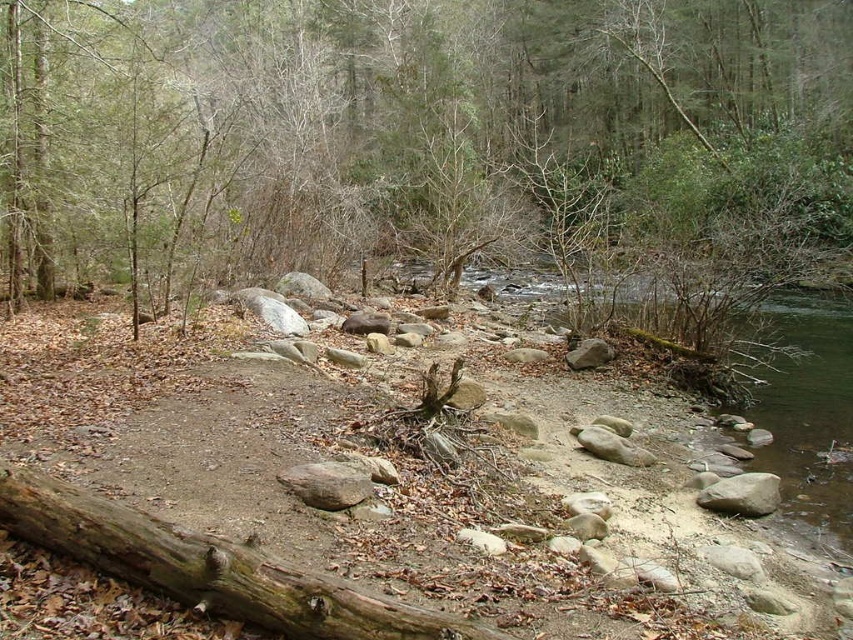
You are standing at the point with coordinates point (x=445, y=627) and want to walk to the point with coordinates point (x=183, y=42). Is the destination point visible from your current position?

The point (x=183, y=42) is behind the point (x=445, y=627), so the destination point is not visible from your current position.

You are standing at the edge of the stream and want to place a small decorative stone on the weathered brown log at lower left. However, you notice the brown wood tree at center is in the way. Can you place the stone there without moving the tree?

The brown wood tree at center is above the weathered brown log at lower left, so placing the stone on the log would require moving the tree out of the way first.

You are a hiker who wants to take a photo of the brown wood tree at center and the weathered brown log at lower left. Which object should you focus on first if you want to capture both in a single frame without moving your camera?

The brown wood tree at center is much taller than the weathered brown log at lower left, so you should focus on the brown wood tree at center first to ensure it fits within the frame.